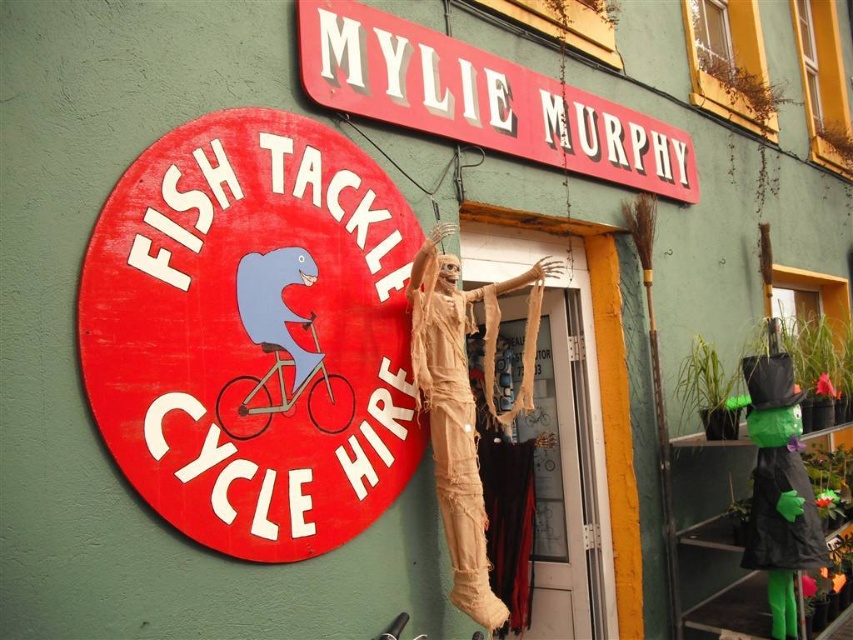
You are planning to hang a new sign on the wall next to the wooden fish tackle cycle hire sign at left and the beige fabric mummy at center. If you want the new sign to be the same size as the smaller of the two, which object should you measure to ensure the correct size?

The beige fabric mummy at center is smaller than the wooden fish tackle cycle hire sign at left, so you should measure the beige fabric mummy at center to ensure the new sign is the correct size.

You are a visitor standing in front of the Mylie Murphy building. You notice the wooden fish tackle cycle hire sign at left and the beige fabric mummy at center. Which object is taller?

The beige fabric mummy at center is taller than the wooden fish tackle cycle hire sign at left.